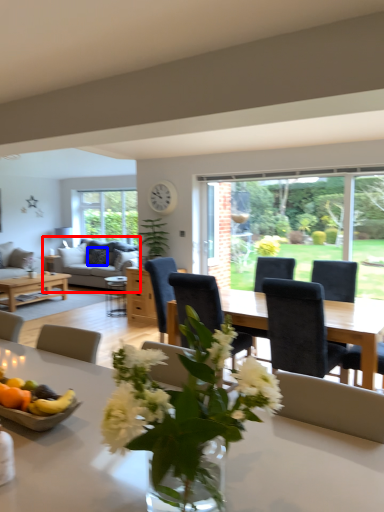
Question: Which of the following is the farthest to the observer, studio couch (highlighted by a red box) or pillow (highlighted by a blue box)?

Choices:
 (A) studio couch
 (B) pillow

Answer: (B)